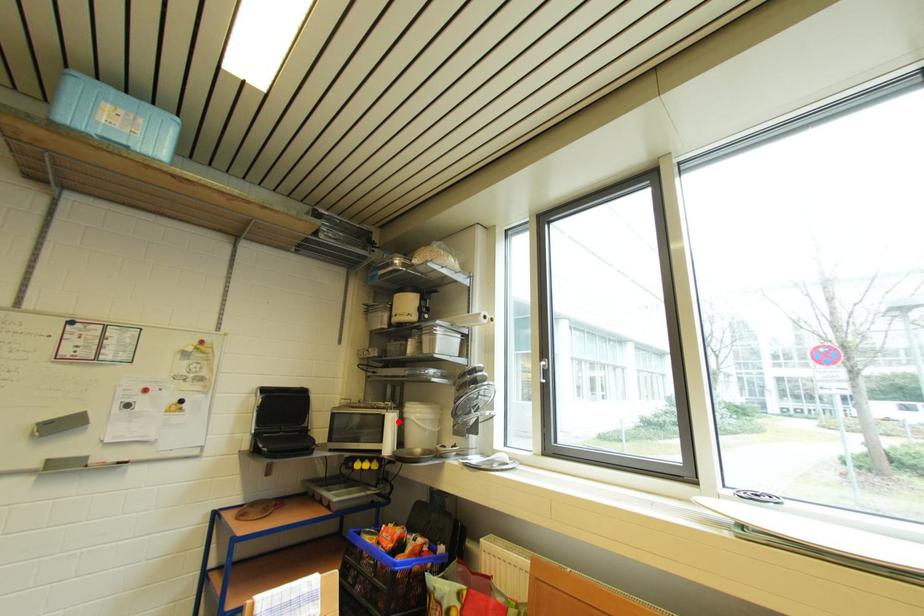
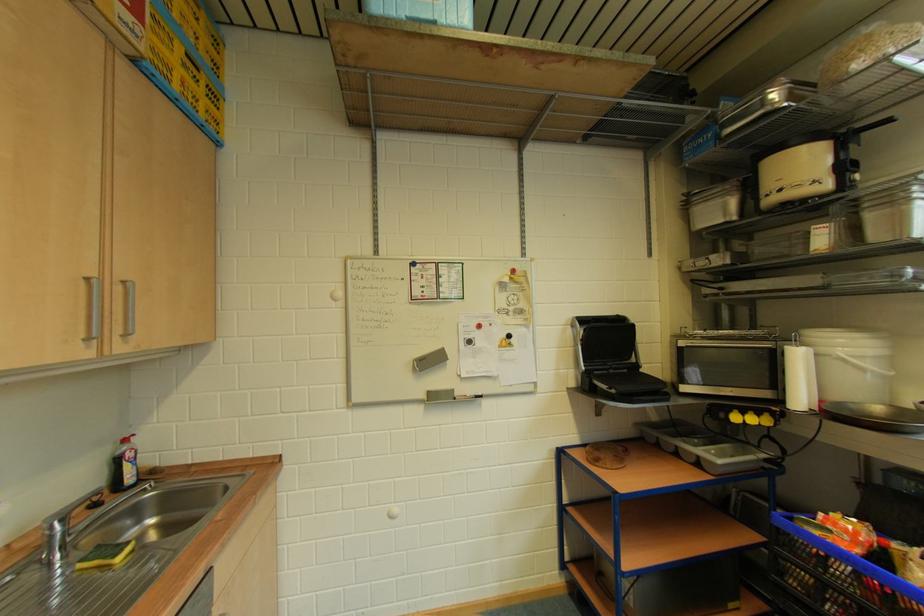
The point at the highlighted location is marked in the first image. Where is the corresponding point in the second image?

(805, 359)